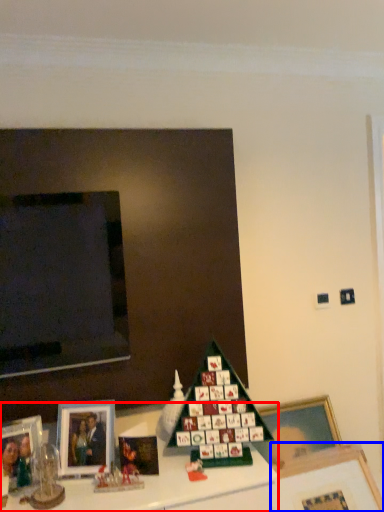
Question: Among these objects, which one is nearest to the camera, furniture (highlighted by a red box) or picture frame (highlighted by a blue box)?

Choices:
 (A) furniture
 (B) picture frame

Answer: (A)